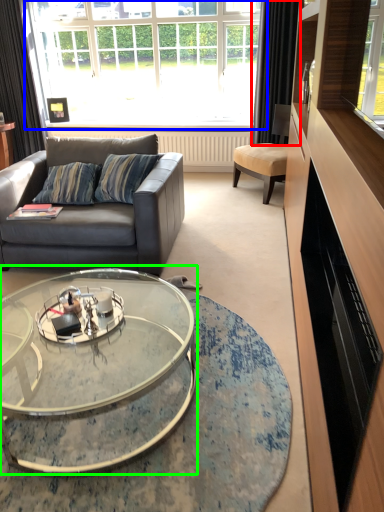
Question: Based on their relative distances, which object is farther from curtain (highlighted by a red box)? Choose from window (highlighted by a blue box) and coffee table (highlighted by a green box).

Choices:
 (A) window
 (B) coffee table

Answer: (B)